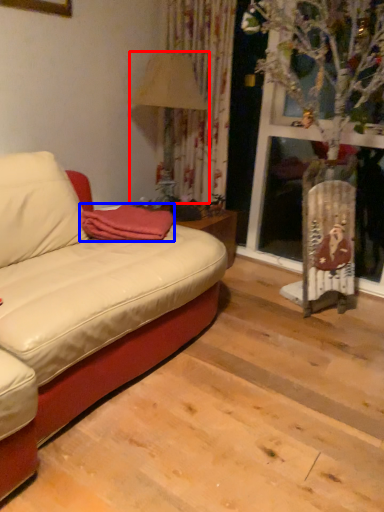
Question: Which object is closer to the camera taking this photo, lamp (highlighted by a red box) or blanket (highlighted by a blue box)?

Choices:
 (A) lamp
 (B) blanket

Answer: (B)